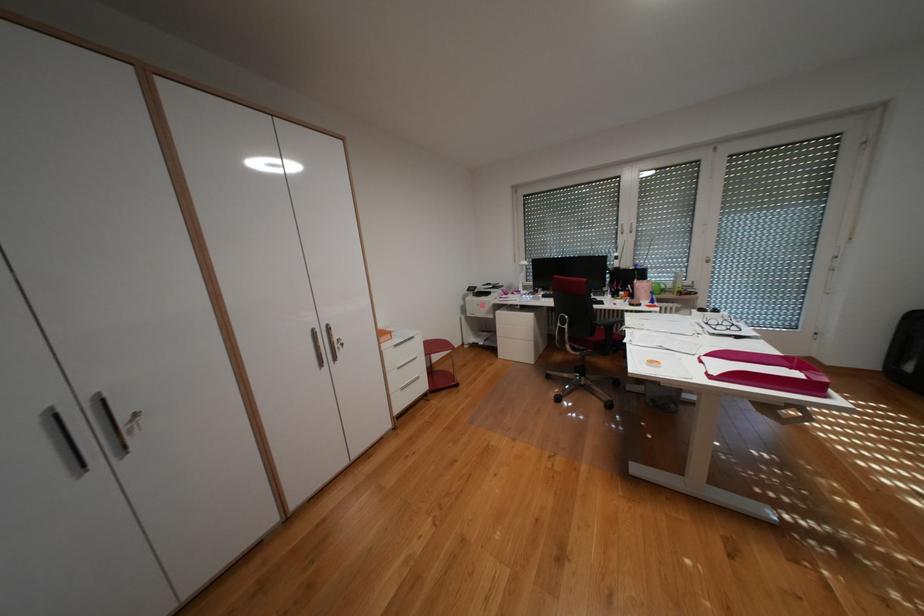
Find the location of a particular element. chair armrest is located at coordinates (614, 321).